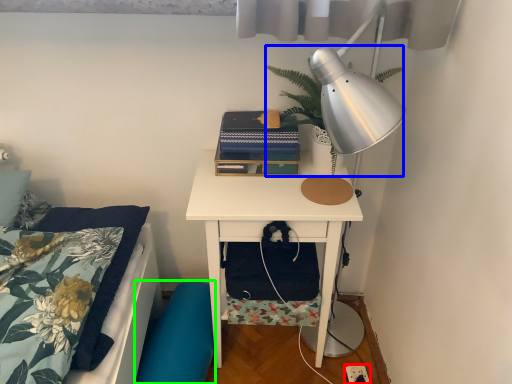
Question: Which object is the closest to the electric outlet (highlighted by a red box)? Choose among these: plant (highlighted by a blue box) or swivel chair (highlighted by a green box).

Choices:
 (A) plant
 (B) swivel chair

Answer: (B)